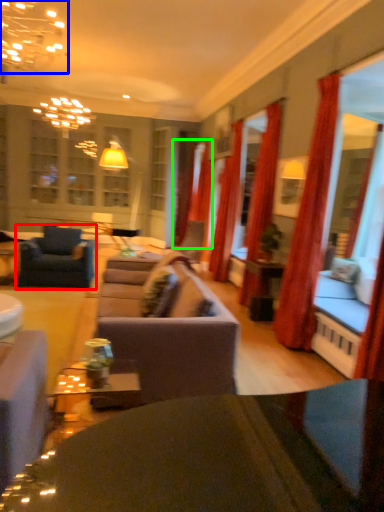
Question: Estimate the real-world distances between objects in this image. Which object is closer to chair (highlighted by a red box), light fixture (highlighted by a blue box) or curtain (highlighted by a green box)?

Choices:
 (A) light fixture
 (B) curtain

Answer: (A)